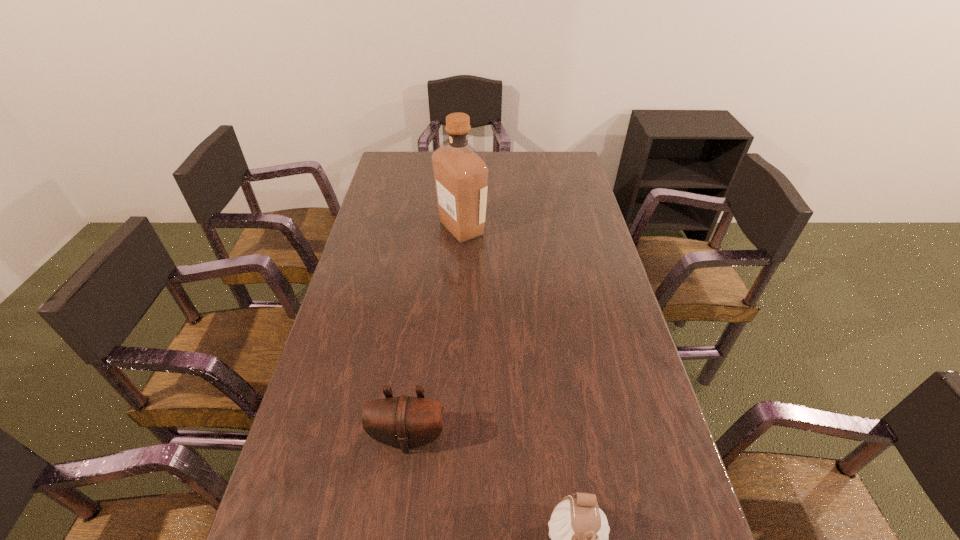
Image resolution: width=960 pixels, height=540 pixels. In order to click on the farthest object in this screenshot , I will do `click(460, 175)`.

The image size is (960, 540). I want to click on liquor, so click(460, 175).

The image size is (960, 540). I want to click on the second farthest object, so click(x=405, y=422).

You are a GUI agent. You are given a task and a screenshot of the screen. Output one action in this format:
    pyautogui.click(x=<x>, y=<y>)
    Task: Click on the left pouch
    
    Given the screenshot: What is the action you would take?
    pyautogui.click(x=405, y=422)

At what (x,y) coordinates should I click in order to perform the action: click on vacant space situated 0.160m on the front-facing side of the tallest object. Please return your answer as a coordinate pair (x, y). The height and width of the screenshot is (540, 960). Looking at the image, I should click on (533, 228).

Locate an element on the screen. free region located with the flap open on the second nearest object is located at coordinates (397, 526).

Find the location of a particular element. free space at the left edge of the desktop is located at coordinates (286, 471).

Where is `vacant space at the right edge of the desktop`? Image resolution: width=960 pixels, height=540 pixels. vacant space at the right edge of the desktop is located at coordinates (609, 420).

Locate an element on the screen. vacant point at the far left corner is located at coordinates tap(403, 164).

At what (x,y) coordinates should I click in order to perform the action: click on free point between the farthest object and the farther pouch. Please return your answer as a coordinate pair (x, y). Looking at the image, I should click on (435, 333).